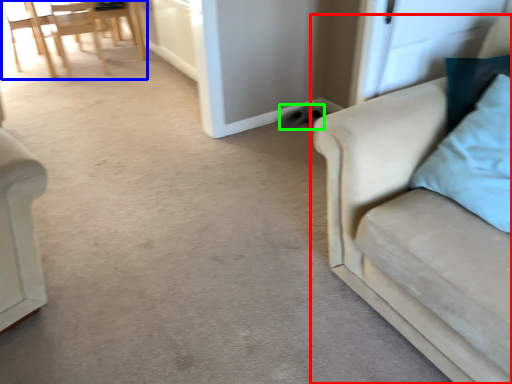
Question: Estimate the real-world distances between objects in this image. Which object is farther from studio couch (highlighted by a red box), chair (highlighted by a blue box) or footwear (highlighted by a green box)?

Choices:
 (A) chair
 (B) footwear

Answer: (A)